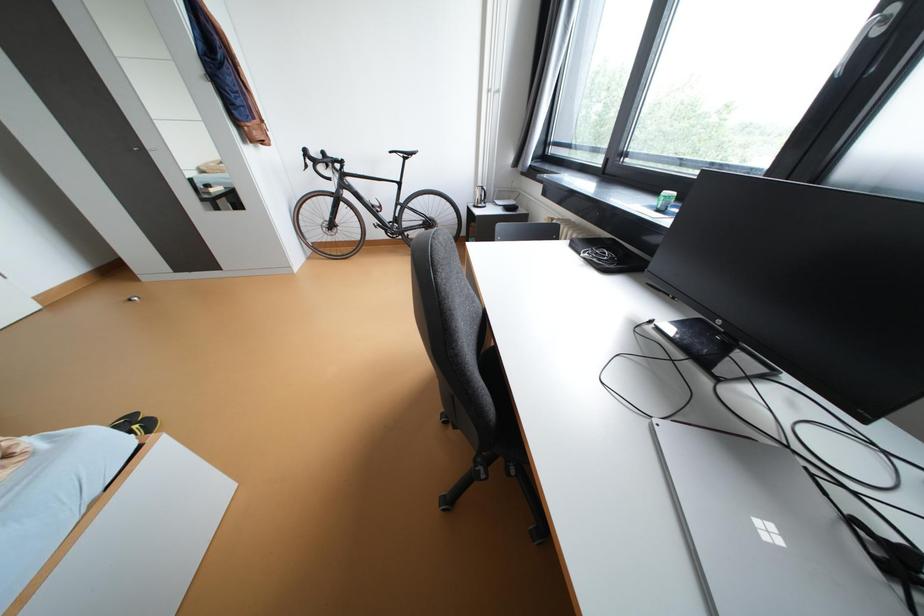
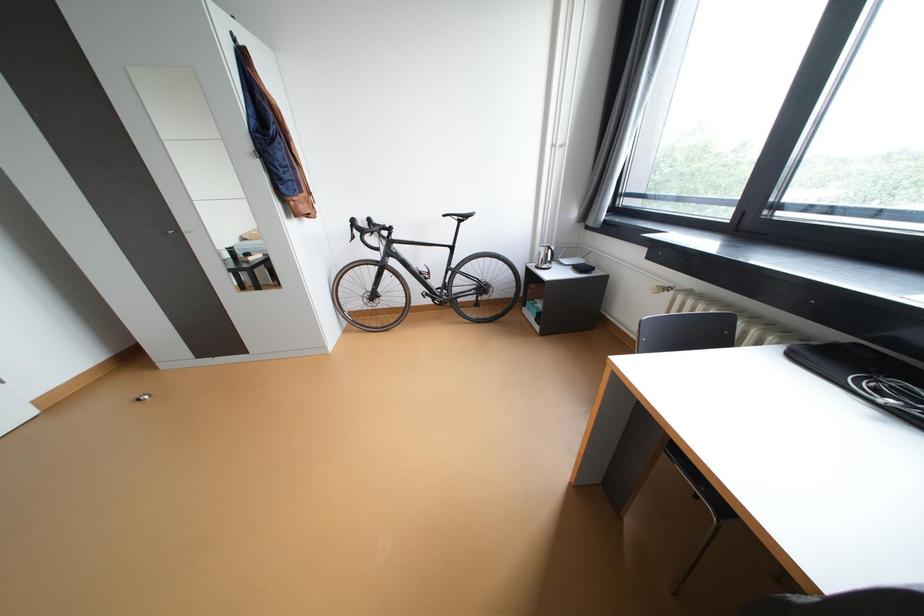
Question: The images are taken continuously from a first-person perspective. In which direction is your viewpoint rotating?

Choices:
 (A) Left
 (B) Right
 (C) Up
 (D) Down

Answer: (C)